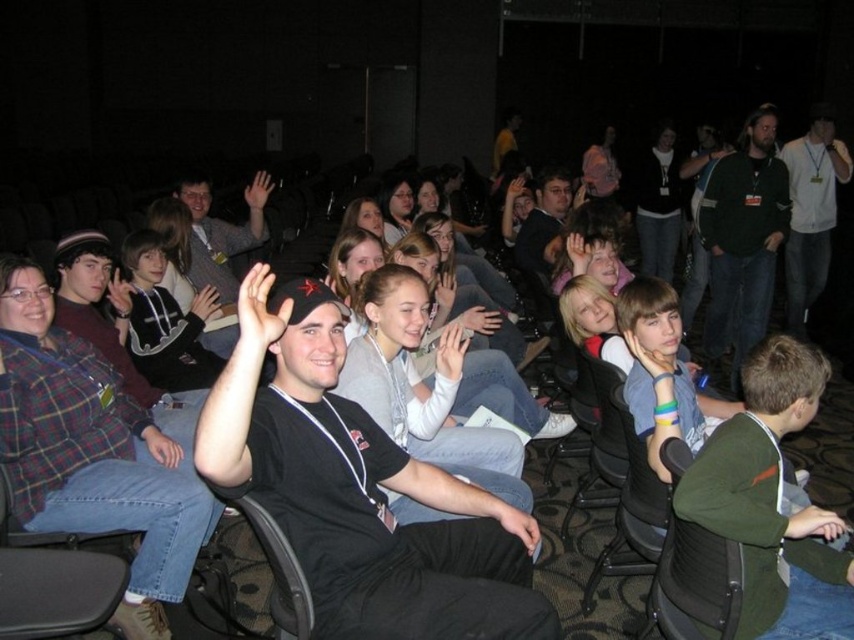
Which is more to the left, white t-shirt at right or matte black shirt at center?

From the viewer's perspective, matte black shirt at center appears more on the left side.

Between white t-shirt at right and matte black shirt at center, which one appears on the right side from the viewer's perspective?

Positioned to the right is white t-shirt at right.

Who is more distant from viewer, [803,176] or [203,248]?

The point [803,176] is behind.

Locate an element on the screen. white t-shirt at right is located at coordinates (811, 211).

Describe the element at coordinates (658, 204) in the screenshot. The image size is (854, 640). I see `black sweater at upper center` at that location.

From the picture: Between black sweater at upper center and black plastic chair at center, which one has less height?

black plastic chair at center is shorter.

Does point (665, 216) come behind point (279, 604)?

That is True.

Where is `black sweater at upper center`? The height and width of the screenshot is (640, 854). black sweater at upper center is located at coordinates (x=658, y=204).

Does point (529, 541) come behind point (665, 269)?

No, it is in front of (665, 269).

Between point (490, 516) and point (653, 272), which one is positioned behind?

Point (653, 272)

What do you see at coordinates (360, 490) in the screenshot?
I see `black matte t-shirt at center` at bounding box center [360, 490].

Find the location of `black matte t-shirt at center`. black matte t-shirt at center is located at coordinates (360, 490).